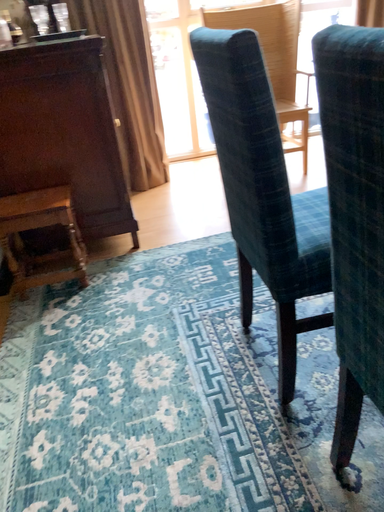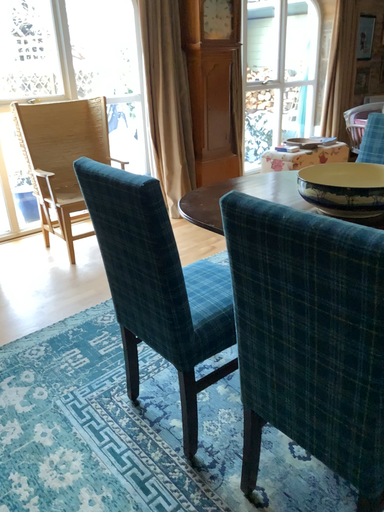
Question: How did the camera likely rotate when shooting the video?

Choices:
 (A) rotated upward
 (B) rotated downward

Answer: (A)